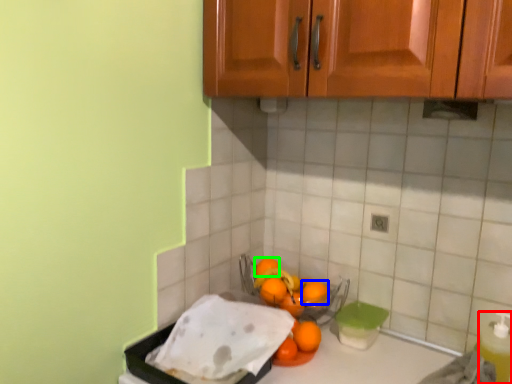
Question: Which is farther away from bottle (highlighted by a red box)? orange (highlighted by a blue box) or orange (highlighted by a green box)?

Choices:
 (A) orange
 (B) orange

Answer: (B)